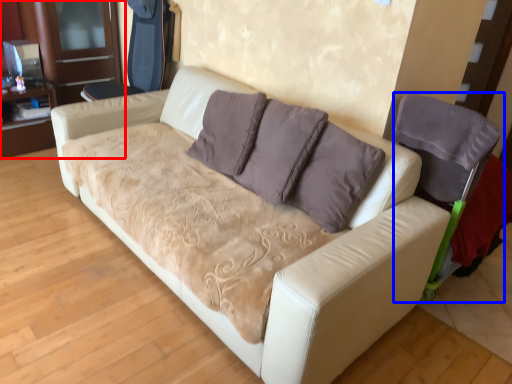
Question: Which object is closer to the camera taking this photo, dresser (highlighted by a red box) or armchair (highlighted by a blue box)?

Choices:
 (A) dresser
 (B) armchair

Answer: (B)